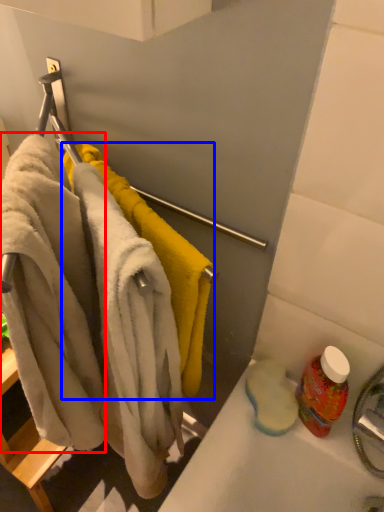
Question: Among these objects, which one is farthest to the camera, bath towel (highlighted by a red box) or towel (highlighted by a blue box)?

Choices:
 (A) bath towel
 (B) towel

Answer: (B)